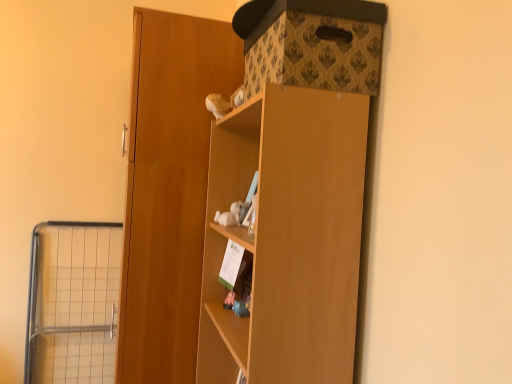
Question: Is wooden door at center bigger than patterned cardboard storage box at upper right?

Choices:
 (A) yes
 (B) no

Answer: (A)

Question: Is wooden door at center oriented away from patterned cardboard storage box at upper right?

Choices:
 (A) yes
 (B) no

Answer: (B)

Question: Is wooden door at center outside patterned cardboard storage box at upper right?

Choices:
 (A) no
 (B) yes

Answer: (B)

Question: Considering the relative positions of wooden door at center and patterned cardboard storage box at upper right in the image provided, is wooden door at center to the left of patterned cardboard storage box at upper right from the viewer's perspective?

Choices:
 (A) yes
 (B) no

Answer: (A)

Question: From a real-world perspective, is wooden door at center located beneath patterned cardboard storage box at upper right?

Choices:
 (A) yes
 (B) no

Answer: (A)

Question: From the image's perspective, is patterned cardboard storage box at upper right located above or below wooden cupboard at center?

Choices:
 (A) below
 (B) above

Answer: (B)

Question: From a real-world perspective, relative to wooden cupboard at center, is patterned cardboard storage box at upper right vertically above or below?

Choices:
 (A) below
 (B) above

Answer: (B)

Question: Is patterned cardboard storage box at upper right wider or thinner than wooden cupboard at center?

Choices:
 (A) wide
 (B) thin

Answer: (B)

Question: Considering the positions of patterned cardboard storage box at upper right and wooden cupboard at center in the image, is patterned cardboard storage box at upper right taller or shorter than wooden cupboard at center?

Choices:
 (A) tall
 (B) short

Answer: (B)

Question: In terms of width, does patterned cardboard storage box at upper right look wider or thinner when compared to metal wire cage at left?

Choices:
 (A) wide
 (B) thin

Answer: (A)

Question: Looking at the image, does patterned cardboard storage box at upper right seem bigger or smaller compared to metal wire cage at left?

Choices:
 (A) big
 (B) small

Answer: (B)

Question: Is patterned cardboard storage box at upper right taller or shorter than metal wire cage at left?

Choices:
 (A) short
 (B) tall

Answer: (A)

Question: Which is correct: patterned cardboard storage box at upper right is inside metal wire cage at left, or outside of it?

Choices:
 (A) inside
 (B) outside

Answer: (B)

Question: Relative to wooden cupboard at center, is metal wire cage at left in front or behind?

Choices:
 (A) front
 (B) behind

Answer: (B)

Question: From a real-world perspective, relative to wooden cupboard at center, is metal wire cage at left vertically above or below?

Choices:
 (A) below
 (B) above

Answer: (A)